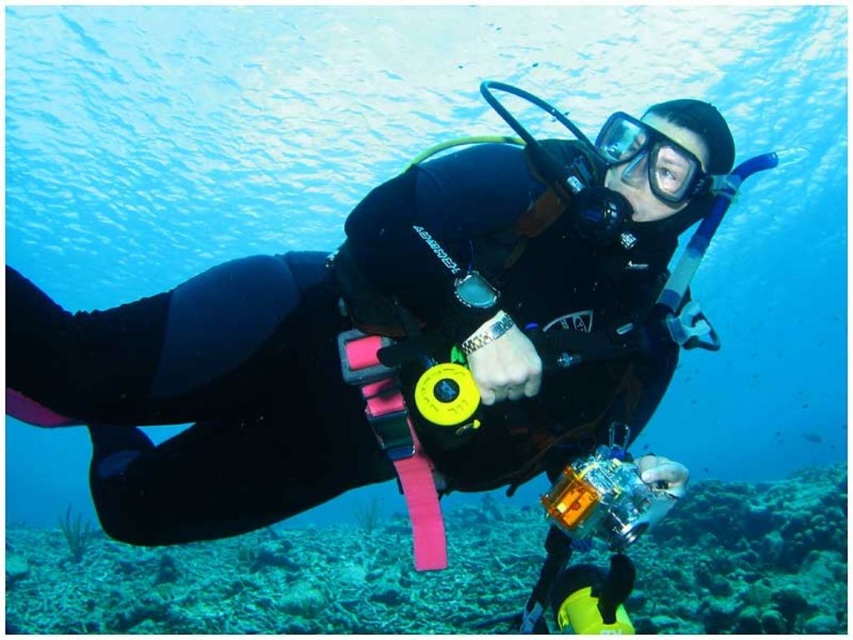
You are an underwater photographer planning to capture a shot of the transparent blue water at center and the transparent rubber goggles at center. Based on their positions, which object should you focus on first to ensure both are in the frame?

You should focus on the transparent rubber goggles at center first because it is closer to you than the transparent blue water at center, allowing both to be in the frame when properly focused.

You are a scuba diver preparing to take a photo of the rough coral reef at lower center using the camera you are holding. To get a clear shot, you need to position yourself so that the transparent blue water at center is between you and the reef. Is this possible based on the scene?

Yes, because the transparent blue water at center is in front of the rough coral reef at lower center, so positioning yourself with the water between you and the reef would allow a clear shot.

You are a marine biologist planning to swim through the transparent blue water at center and the rough coral reef at lower center. Which path has a wider passage for you to swim through?

A: The transparent blue water at center has a wider passage than the rough coral reef at lower center because its width surpasses the coral reef.